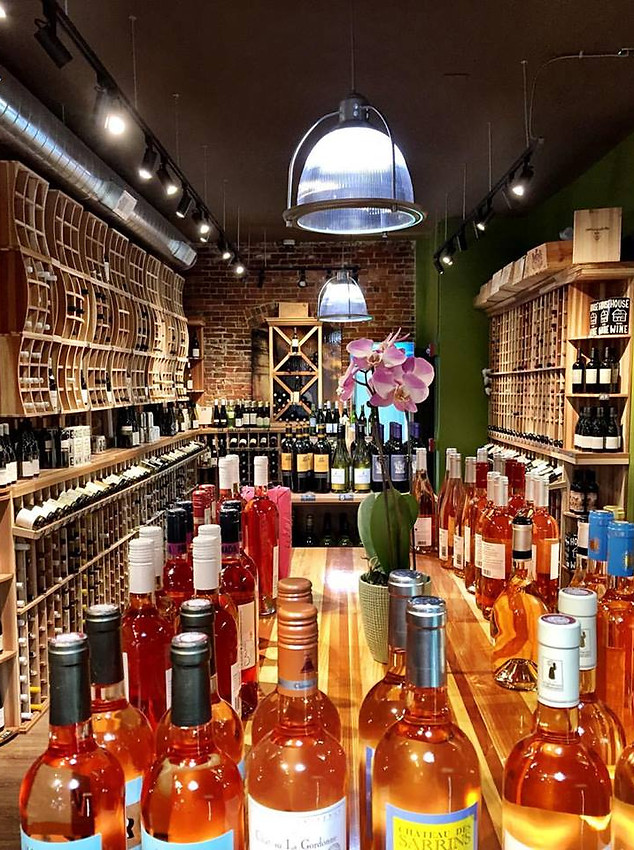
This screenshot has height=850, width=634. What are the coordinates of `green wall` in the screenshot? It's located at (466, 383).